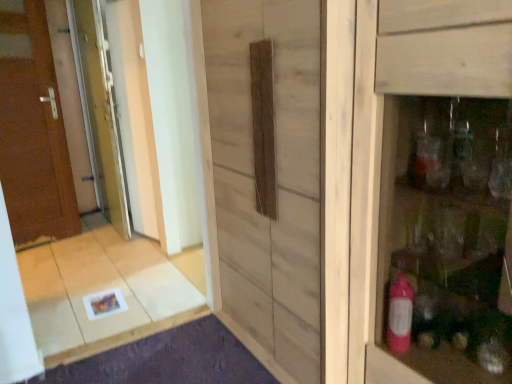
Where is `clear glass screen door at left, which is the first screen door in left-to-right order`? clear glass screen door at left, which is the first screen door in left-to-right order is located at coordinates (100, 111).

Describe the element at coordinates (132, 112) in the screenshot. The height and width of the screenshot is (384, 512). I see `clear glass screen door at left, which is the first screen door from right to left` at that location.

Measure the distance between natural wood barn door at center and camera.

They are 1.21 meters apart.

The width and height of the screenshot is (512, 384). In order to click on brown wooden door at left in this screenshot , I will do `click(33, 129)`.

In order to click on cabinetry to the right of clear glass screen door at left, the second screen door viewed from the right in this screenshot , I will do `click(437, 187)`.

Is matte wooden cabinet at right aimed at clear glass screen door at left, which is the first screen door in left-to-right order?

No, matte wooden cabinet at right is not oriented towards clear glass screen door at left, which is the first screen door in left-to-right order.

Consider the image. Can you confirm if matte wooden cabinet at right is smaller than clear glass screen door at left, which is the first screen door in left-to-right order?

No.

From a real-world perspective, is matte wooden cabinet at right over clear glass screen door at left, which is the first screen door in left-to-right order?

Actually, matte wooden cabinet at right is physically below clear glass screen door at left, which is the first screen door in left-to-right order, in the real world.

Between natural wood barn door at center and matte wooden cabinet at right, which one has more height?

Standing taller between the two is natural wood barn door at center.

Is natural wood barn door at center to the right of matte wooden cabinet at right from the viewer's perspective?

In fact, natural wood barn door at center is to the left of matte wooden cabinet at right.

Which object is further away from the camera taking this photo, natural wood barn door at center or matte wooden cabinet at right?

Positioned behind is natural wood barn door at center.

Is brown wooden door at left thinner than natural wood barn door at center?

Yes, brown wooden door at left is thinner than natural wood barn door at center.

Considering the sizes of objects brown wooden door at left and natural wood barn door at center in the image provided, who is smaller, brown wooden door at left or natural wood barn door at center?

brown wooden door at left.

Which is correct: brown wooden door at left is inside natural wood barn door at center, or outside of it?

The correct answer is: outside.

Is brown wooden door at left with natural wood barn door at center?

No.

Find the location of `screen door lying below the clear glass screen door at left, which is the first screen door in left-to-right order (from the image's perspective)`. screen door lying below the clear glass screen door at left, which is the first screen door in left-to-right order (from the image's perspective) is located at coordinates (132, 112).

From the image's perspective, does clear glass screen door at left, the second screen door viewed from the right, appear higher than clear glass screen door at left, which is the first screen door from right to left?

Correct, clear glass screen door at left, the second screen door viewed from the right, appears higher than clear glass screen door at left, which is the first screen door from right to left, in the image.

Is clear glass screen door at left, the second screen door viewed from the right, in front of or behind clear glass screen door at left, acting as the 2th screen door starting from the left, in the image?

Visually, clear glass screen door at left, the second screen door viewed from the right, is located behind clear glass screen door at left, acting as the 2th screen door starting from the left.

Are clear glass screen door at left, the second screen door viewed from the right, and clear glass screen door at left, acting as the 2th screen door starting from the left, making contact?

They are not placed beside each other.

How many degrees apart are the facing directions of clear glass screen door at left, acting as the 2th screen door starting from the left, and matte wooden cabinet at right?

They differ by 0.659 degrees in their facing directions.

From the image's perspective, between clear glass screen door at left, acting as the 2th screen door starting from the left, and matte wooden cabinet at right, which one is located above?

clear glass screen door at left, acting as the 2th screen door starting from the left.

Is clear glass screen door at left, acting as the 2th screen door starting from the left, facing away from matte wooden cabinet at right?

No, clear glass screen door at left, acting as the 2th screen door starting from the left,'s orientation is not away from matte wooden cabinet at right.

Which is behind, point (233, 241) or point (154, 231)?

Positioned behind is point (154, 231).

Looking at this image, is natural wood barn door at center oriented towards clear glass screen door at left, which is the first screen door from right to left?

No, natural wood barn door at center is not oriented towards clear glass screen door at left, which is the first screen door from right to left.

From the image's perspective, relative to clear glass screen door at left, which is the first screen door from right to left, is natural wood barn door at center above or below?

Based on their image positions, natural wood barn door at center is located beneath clear glass screen door at left, which is the first screen door from right to left.

Based on the photo, can you tell me how much natural wood barn door at center and clear glass screen door at left, which is the first screen door from right to left, differ in facing direction?

natural wood barn door at center and clear glass screen door at left, which is the first screen door from right to left, are facing 0.189 degrees away from each other.

Considering the sizes of matte wooden cabinet at right and brown wooden door at left in the image, is matte wooden cabinet at right bigger or smaller than brown wooden door at left?

Considering their sizes, matte wooden cabinet at right takes up more space than brown wooden door at left.

Does matte wooden cabinet at right have a lesser height compared to brown wooden door at left?

Yes.

How different are the orientations of matte wooden cabinet at right and brown wooden door at left in degrees?

There is a 102-degree angle between the facing directions of matte wooden cabinet at right and brown wooden door at left.

Which is in front, matte wooden cabinet at right or brown wooden door at left?

matte wooden cabinet at right is more forward.

Where is `cabinetry that is below the clear glass screen door at left, the second screen door viewed from the right (from the image's perspective)`? cabinetry that is below the clear glass screen door at left, the second screen door viewed from the right (from the image's perspective) is located at coordinates (437, 187).

Where is `cabinetry on the right side of natural wood barn door at center`? This screenshot has width=512, height=384. cabinetry on the right side of natural wood barn door at center is located at coordinates (437, 187).

Estimate the real-world distances between objects in this image. Which object is closer to clear glass screen door at left, which is the first screen door in left-to-right order, natural wood barn door at center or brown wooden door at left?

The object closer to clear glass screen door at left, which is the first screen door in left-to-right order, is brown wooden door at left.

Which object lies nearer to the anchor point natural wood barn door at center, clear glass screen door at left, the second screen door viewed from the right, or matte wooden cabinet at right?

Based on the image, matte wooden cabinet at right appears to be nearer to natural wood barn door at center.

Considering their positions, is natural wood barn door at center positioned closer to brown wooden door at left than matte wooden cabinet at right?

Based on the image, natural wood barn door at center appears to be nearer to brown wooden door at left.

From the picture: Considering their positions, is matte wooden cabinet at right positioned further to clear glass screen door at left, which is the first screen door from right to left, than brown wooden door at left?

→ matte wooden cabinet at right lies further to clear glass screen door at left, which is the first screen door from right to left, than the other object.

Estimate the real-world distances between objects in this image. Which object is closer to natural wood barn door at center, clear glass screen door at left, the second screen door viewed from the right, or brown wooden door at left?

The object closer to natural wood barn door at center is clear glass screen door at left, the second screen door viewed from the right.

Estimate the real-world distances between objects in this image. Which object is further from clear glass screen door at left, the second screen door viewed from the right, brown wooden door at left or natural wood barn door at center?

natural wood barn door at center is positioned further to the anchor clear glass screen door at left, the second screen door viewed from the right.

Estimate the real-world distances between objects in this image. Which object is further from matte wooden cabinet at right, brown wooden door at left or clear glass screen door at left, which is the first screen door in left-to-right order?

Based on the image, brown wooden door at left appears to be further to matte wooden cabinet at right.

Based on their spatial positions, is natural wood barn door at center or clear glass screen door at left, which is the first screen door in left-to-right order, further from brown wooden door at left?

Among the two, natural wood barn door at center is located further to brown wooden door at left.

Locate an element on the screen. This screenshot has width=512, height=384. barn door between matte wooden cabinet at right and clear glass screen door at left, which is the first screen door in left-to-right order, along the z-axis is located at coordinates (268, 172).

The image size is (512, 384). Identify the location of screen door between brown wooden door at left and clear glass screen door at left, which is the first screen door from right to left. (100, 111).

You are a GUI agent. You are given a task and a screenshot of the screen. Output one action in this format:
    pyautogui.click(x=<x>, y=<y>)
    Task: Click on the screen door between matte wooden cabinet at right and clear glass screen door at left, the second screen door viewed from the right, in the front-back direction
    Image resolution: width=512 pixels, height=384 pixels.
    Given the screenshot: What is the action you would take?
    pyautogui.click(x=132, y=112)

Locate an element on the screen. screen door located between natural wood barn door at center and clear glass screen door at left, the second screen door viewed from the right, in the depth direction is located at coordinates (132, 112).